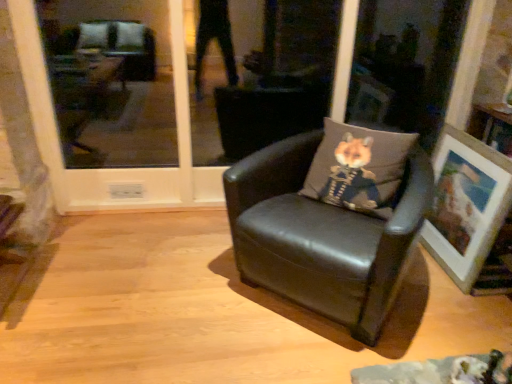
Where is `gray fabric pillow with fox print at center`? Image resolution: width=512 pixels, height=384 pixels. gray fabric pillow with fox print at center is located at coordinates (358, 168).

I want to click on transparent glass door at center, so click(114, 168).

What is the approximate height of transparent glass door at center?

It is 4.01 feet.

What is the approximate height of wooden picture frame at right?

The height of wooden picture frame at right is 26.61 inches.

This screenshot has height=384, width=512. Identify the location of gray fabric pillow with fox print at center. (358, 168).

Which object is closer to the camera taking this photo, gray fabric pillow with fox print at center or transparent glass door at center?

Positioned in front is gray fabric pillow with fox print at center.

Could transparent glass door at center be considered to be inside gray fabric pillow with fox print at center?

No.

From the image's perspective, is gray fabric pillow with fox print at center on top of transparent glass door at center?

No, from the image's perspective, gray fabric pillow with fox print at center is not on top of transparent glass door at center.

This screenshot has height=384, width=512. In order to click on picture frame that is on the right side of transparent glass door at center in this screenshot , I will do `click(470, 213)`.

From a real-world perspective, is transparent glass door at center located higher than wooden picture frame at right?

Yes, from a real-world perspective, transparent glass door at center is above wooden picture frame at right.

Is transparent glass door at center not near wooden picture frame at right?

Yes, transparent glass door at center is far from wooden picture frame at right.

From the image's perspective, is transparent glass door at center below wooden picture frame at right?

No.

Can you tell me how much black leather chair at center and wooden picture frame at right differ in facing direction?

The angle between the facing direction of black leather chair at center and the facing direction of wooden picture frame at right is 47.7 degrees.

Is black leather chair at center not near wooden picture frame at right?

black leather chair at center is near wooden picture frame at right, not far away.

Which of these two, black leather chair at center or wooden picture frame at right, is smaller?

wooden picture frame at right is smaller.

Is black leather chair at center facing towards wooden picture frame at right?

No, black leather chair at center is not facing towards wooden picture frame at right.

Measure the distance between black leather chair at center and gray fabric pillow with fox print at center.

black leather chair at center is 8.46 inches away from gray fabric pillow with fox print at center.

Locate an element on the screen. The height and width of the screenshot is (384, 512). pillow that appears above the black leather chair at center (from a real-world perspective) is located at coordinates (358, 168).

Does black leather chair at center have a smaller size compared to gray fabric pillow with fox print at center?

No, black leather chair at center is not smaller than gray fabric pillow with fox print at center.

Can you confirm if black leather chair at center is wider than gray fabric pillow with fox print at center?

Correct, the width of black leather chair at center exceeds that of gray fabric pillow with fox print at center.

Is wooden picture frame at right facing away from transparent glass door at center?

No, transparent glass door at center is not at the back of wooden picture frame at right.

Is wooden picture frame at right beside transparent glass door at center?

There is a gap between wooden picture frame at right and transparent glass door at center.

Is wooden picture frame at right situated inside transparent glass door at center or outside?

wooden picture frame at right is located beyond the bounds of transparent glass door at center.

Between black leather chair at center and transparent glass door at center, which one has smaller width?

transparent glass door at center is thinner.

Is black leather chair at center positioned far away from transparent glass door at center?

black leather chair at center is positioned a significant distance from transparent glass door at center.

From a real-world perspective, is black leather chair at center on transparent glass door at center?

No, from a real-world perspective, black leather chair at center is not over transparent glass door at center

How many degrees apart are the facing directions of black leather chair at center and transparent glass door at center?

black leather chair at center and transparent glass door at center are facing 41.6 degrees away from each other.

From a real-world perspective, is gray fabric pillow with fox print at center on top of black leather chair at center?

Yes, from a real-world perspective, gray fabric pillow with fox print at center is above black leather chair at center.

Does gray fabric pillow with fox print at center come in front of black leather chair at center?

No, gray fabric pillow with fox print at center is further to the viewer.

From the picture: Considering the sizes of objects gray fabric pillow with fox print at center and black leather chair at center in the image provided, who is thinner, gray fabric pillow with fox print at center or black leather chair at center?

Thinner between the two is gray fabric pillow with fox print at center.

Does point (349, 179) come behind point (397, 268)?

Yes, it is.

What are the coordinates of `glass door behind the gray fabric pillow with fox print at center` in the screenshot? It's located at (114, 168).

In the image, there is a transparent glass door at center. At what (x,y) coordinates should I click in order to perform the action: click on picture frame below it (from a real-world perspective). Please return your answer as a coordinate pair (x, y). Looking at the image, I should click on (470, 213).

When comparing their distances from wooden picture frame at right, does transparent glass door at center or black leather chair at center seem further?

transparent glass door at center is further to wooden picture frame at right.

Based on the photo, looking at the image, which one is located further to transparent glass door at center, black leather chair at center or wooden picture frame at right?

wooden picture frame at right is positioned further to the anchor transparent glass door at center.

Considering their positions, is wooden picture frame at right positioned closer to transparent glass door at center than gray fabric pillow with fox print at center?

Based on the image, gray fabric pillow with fox print at center appears to be nearer to transparent glass door at center.

When comparing their distances from black leather chair at center, does transparent glass door at center or wooden picture frame at right seem further?

transparent glass door at center is further to black leather chair at center.

Based on their spatial positions, is black leather chair at center or transparent glass door at center closer to gray fabric pillow with fox print at center?

The object closer to gray fabric pillow with fox print at center is black leather chair at center.

Which object lies nearer to the anchor point gray fabric pillow with fox print at center, black leather chair at center or wooden picture frame at right?

Among the two, black leather chair at center is located nearer to gray fabric pillow with fox print at center.

From the image, which object appears to be nearer to black leather chair at center, wooden picture frame at right or gray fabric pillow with fox print at center?

Based on the image, gray fabric pillow with fox print at center appears to be nearer to black leather chair at center.

In the scene shown: When comparing their distances from transparent glass door at center, does wooden picture frame at right or black leather chair at center seem closer?

Based on the image, black leather chair at center appears to be nearer to transparent glass door at center.

The image size is (512, 384). In order to click on pillow between black leather chair at center and transparent glass door at center in the front-back direction in this screenshot , I will do `click(358, 168)`.

Locate an element on the screen. Image resolution: width=512 pixels, height=384 pixels. chair between transparent glass door at center and wooden picture frame at right in the horizontal direction is located at coordinates (322, 236).

Find the location of a particular element. This screenshot has height=384, width=512. pillow between transparent glass door at center and wooden picture frame at right in the horizontal direction is located at coordinates (358, 168).

Locate an element on the screen. This screenshot has height=384, width=512. pillow situated between black leather chair at center and wooden picture frame at right from left to right is located at coordinates (358, 168).